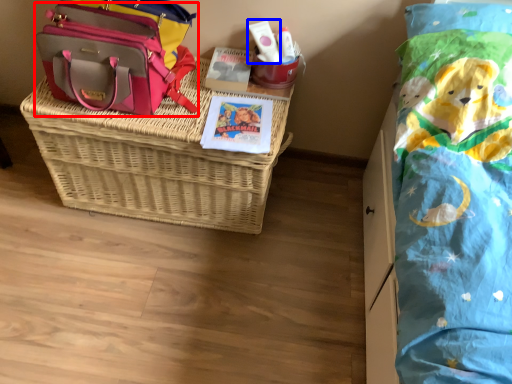
Question: Among these objects, which one is nearest to the camera, shoulder bag (highlighted by a red box) or toiletry (highlighted by a blue box)?

Choices:
 (A) shoulder bag
 (B) toiletry

Answer: (A)